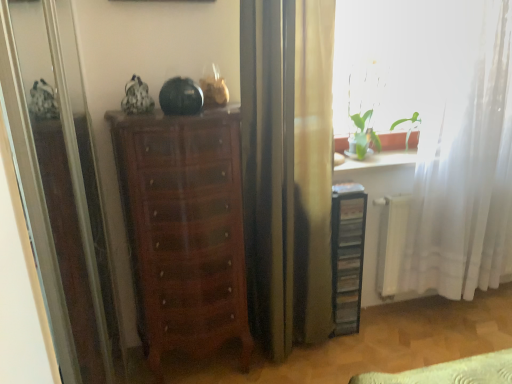
Question: Is shiny brown chest of drawers at center wider than white sheer curtain at right?

Choices:
 (A) yes
 (B) no

Answer: (A)

Question: Can you confirm if shiny brown chest of drawers at center is positioned to the left of white sheer curtain at right?

Choices:
 (A) no
 (B) yes

Answer: (B)

Question: Is shiny brown chest of drawers at center positioned in front of white sheer curtain at right?

Choices:
 (A) no
 (B) yes

Answer: (B)

Question: Does shiny brown chest of drawers at center have a greater height compared to white sheer curtain at right?

Choices:
 (A) no
 (B) yes

Answer: (A)

Question: From the image's perspective, is shiny brown chest of drawers at center below white sheer curtain at right?

Choices:
 (A) no
 (B) yes

Answer: (B)

Question: Would you say shiny brown chest of drawers at center is to the left or to the right of black plastic file cabinet at right in the picture?

Choices:
 (A) right
 (B) left

Answer: (B)

Question: Considering the positions of point (162, 175) and point (346, 235), is point (162, 175) closer or farther from the camera than point (346, 235)?

Choices:
 (A) closer
 (B) farther

Answer: (A)

Question: Would you say shiny brown chest of drawers at center is inside or outside black plastic file cabinet at right?

Choices:
 (A) inside
 (B) outside

Answer: (B)

Question: In terms of height, does shiny brown chest of drawers at center look taller or shorter compared to black plastic file cabinet at right?

Choices:
 (A) tall
 (B) short

Answer: (A)

Question: Considering the positions of shiny brown chest of drawers at center and white sheer curtain at right in the image, is shiny brown chest of drawers at center wider or thinner than white sheer curtain at right?

Choices:
 (A) wide
 (B) thin

Answer: (A)

Question: Is shiny brown chest of drawers at center bigger or smaller than white sheer curtain at right?

Choices:
 (A) big
 (B) small

Answer: (B)

Question: From the image's perspective, is shiny brown chest of drawers at center above or below white sheer curtain at right?

Choices:
 (A) below
 (B) above

Answer: (A)

Question: Does point (188, 132) appear closer or farther from the camera than point (456, 175)?

Choices:
 (A) closer
 (B) farther

Answer: (A)

Question: From a real-world perspective, is transparent glass screen door at left above or below shiny brown chest of drawers at center?

Choices:
 (A) below
 (B) above

Answer: (B)

Question: Does point (70, 87) appear closer or farther from the camera than point (245, 279)?

Choices:
 (A) farther
 (B) closer

Answer: (B)